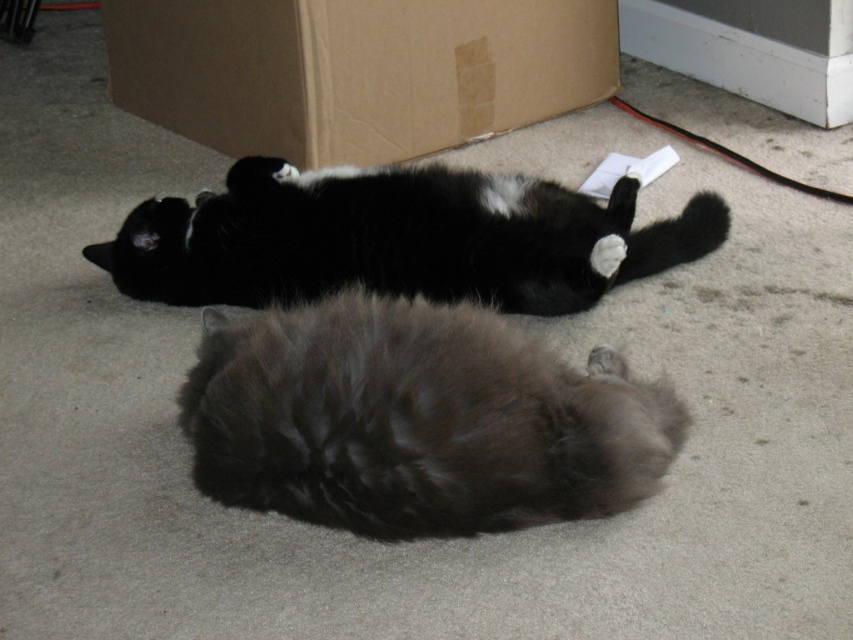
Describe the element at coordinates (416, 419) in the screenshot. The height and width of the screenshot is (640, 853). I see `fluffy gray cat at center` at that location.

Who is more forward, [636,499] or [692,51]?

Point [636,499]

The image size is (853, 640). I want to click on fluffy gray cat at center, so click(416, 419).

Is point (361, 253) in front of point (720, 58)?

Yes, it is in front of point (720, 58).

Describe the element at coordinates (398, 240) in the screenshot. I see `black fur cat at upper center` at that location.

Measure the distance between black fur cat at upper center and camera.

black fur cat at upper center is 1.88 meters from camera.

Identify the location of black fur cat at upper center. (398, 240).

I want to click on cardboard box at upper center, so click(357, 70).

Can you confirm if cardboard box at upper center is bigger than white glossy baseboard at upper right?

Correct, cardboard box at upper center is larger in size than white glossy baseboard at upper right.

Which is behind, point (364, 45) or point (824, 68)?

Positioned behind is point (824, 68).

Find the location of a particular element. The image size is (853, 640). cardboard box at upper center is located at coordinates (357, 70).